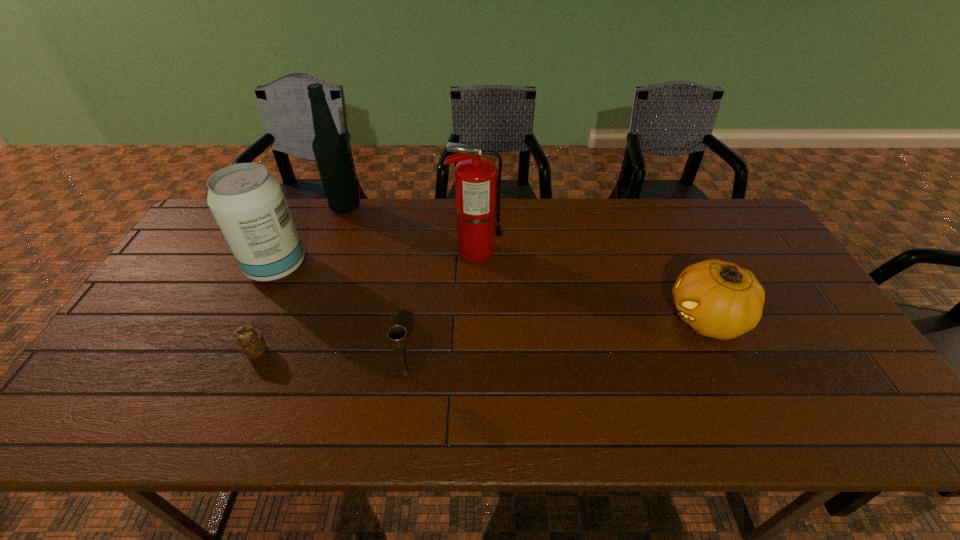
In order to click on vacant area that lies between the farther alcohol and the muffin in this screenshot , I will do `click(300, 279)`.

I want to click on vacant area that lies between the fire extinguisher and the right alcohol, so click(411, 229).

Image resolution: width=960 pixels, height=540 pixels. Identify the location of vacant region between the shortest object and the chalice. (330, 362).

Find the location of a particular element. This screenshot has width=960, height=540. empty space that is in between the chalice and the taller alcohol is located at coordinates (375, 290).

Identify the location of free space between the chalice and the farthest object. Image resolution: width=960 pixels, height=540 pixels. (375, 290).

This screenshot has height=540, width=960. Find the location of `object that is the second closest to the taller alcohol`. object that is the second closest to the taller alcohol is located at coordinates (477, 189).

Identify which object is the closest to the muffin. Please provide its 2D coordinates. Your answer should be formatted as a tuple, i.e. [(x, y)], where the tuple contains the x and y coordinates of a point satisfying the conditions above.

[(248, 203)]

Locate an element on the screen. free space that satisfies the following two spatial constraints: 1. on the front side of the second shortest object; 2. on the right side of the shortest object is located at coordinates (246, 373).

This screenshot has width=960, height=540. What are the coordinates of `free space in the image that satisfies the following two spatial constraints: 1. at the nozzle of the second object from right to left; 2. on the front side of the third object from right to left` in the screenshot? It's located at (474, 373).